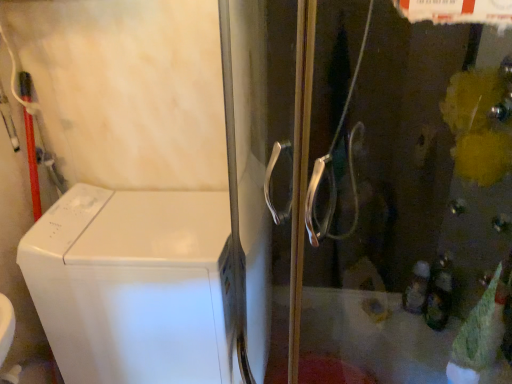
Question: From their relative heights in the image, would you say white glossy washing machine at left is taller or shorter than transparent glass screen door at center?

Choices:
 (A) short
 (B) tall

Answer: (A)

Question: From a real-world perspective, is white glossy washing machine at left above or below transparent glass screen door at center?

Choices:
 (A) below
 (B) above

Answer: (A)

Question: Considering the relative positions of white glossy washing machine at left and transparent glass screen door at center in the image provided, is white glossy washing machine at left to the left or to the right of transparent glass screen door at center?

Choices:
 (A) left
 (B) right

Answer: (A)

Question: Would you say transparent glass screen door at center is to the left or to the right of white glossy washing machine at left in the picture?

Choices:
 (A) left
 (B) right

Answer: (B)

Question: From their relative heights in the image, would you say transparent glass screen door at center is taller or shorter than white glossy washing machine at left?

Choices:
 (A) short
 (B) tall

Answer: (B)

Question: Considering the positions of transparent glass screen door at center and white glossy washing machine at left in the image, is transparent glass screen door at center bigger or smaller than white glossy washing machine at left?

Choices:
 (A) small
 (B) big

Answer: (B)

Question: From a real-world perspective, is transparent glass screen door at center positioned above or below white glossy washing machine at left?

Choices:
 (A) below
 (B) above

Answer: (B)